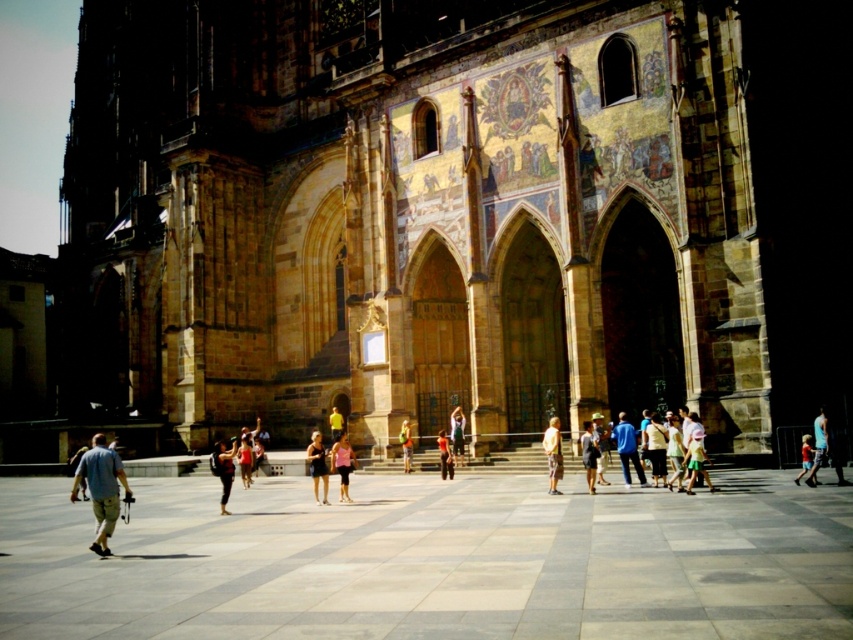
Is pink fabric shorts at center thinner than dark blue fabric dress at center?

Incorrect, pink fabric shorts at center's width is not less than dark blue fabric dress at center's.

Does pink fabric shorts at center appear over dark blue fabric dress at center?

Incorrect, pink fabric shorts at center is not positioned above dark blue fabric dress at center.

Measure the distance between pink fabric shorts at center and camera.

pink fabric shorts at center is 45.66 meters from camera.

This screenshot has height=640, width=853. Identify the location of pink fabric shorts at center. (341, 465).

Is point (219, 448) farther from viewer compared to point (318, 472)?

Yes, it is.

Does dark blue jeans at center appear on the right side of matte black shorts at center?

Incorrect, dark blue jeans at center is not on the right side of matte black shorts at center.

Is point (222, 468) positioned in front of point (312, 480)?

That is True.

Where is `dark blue jeans at center`? This screenshot has height=640, width=853. dark blue jeans at center is located at coordinates [223, 468].

Is matte black shorts at center to the left of pink fabric shorts at center from the viewer's perspective?

Correct, you'll find matte black shorts at center to the left of pink fabric shorts at center.

Can you confirm if matte black shorts at center is positioned above pink fabric shorts at center?

Incorrect, matte black shorts at center is not positioned above pink fabric shorts at center.

Who is more forward, (311, 440) or (335, 442)?

Point (335, 442) is more forward.

This screenshot has height=640, width=853. Find the location of `matte black shorts at center`. matte black shorts at center is located at coordinates (317, 465).